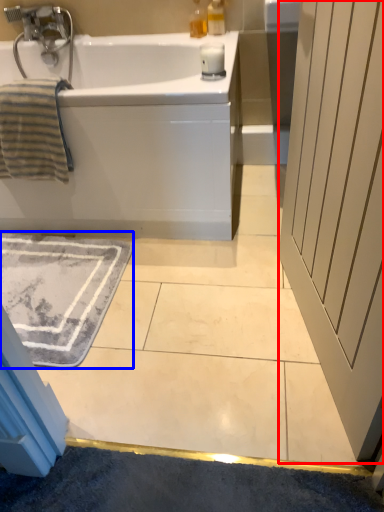
Question: Among these objects, which one is farthest to the camera, screen door (highlighted by a red box) or bath mat (highlighted by a blue box)?

Choices:
 (A) screen door
 (B) bath mat

Answer: (B)